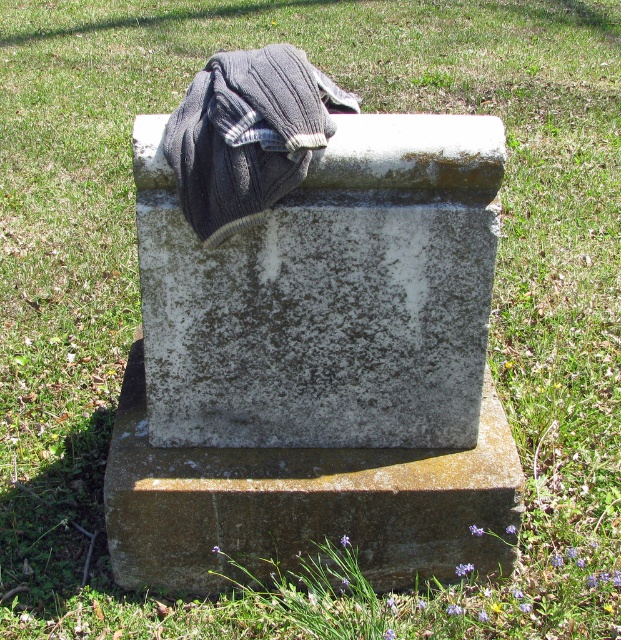
Question: Does gray stone gravestone at center have a greater width compared to gray knitted blanket at upper center?

Choices:
 (A) yes
 (B) no

Answer: (A)

Question: Is gray stone gravestone at center above gray knitted blanket at upper center?

Choices:
 (A) no
 (B) yes

Answer: (A)

Question: Which of the following is the closest to the observer?

Choices:
 (A) gray knitted blanket at upper center
 (B) gray stone gravestone at center

Answer: (A)

Question: Which of the following is the closest to the observer?

Choices:
 (A) (340, 100)
 (B) (122, 468)

Answer: (A)

Question: Among these objects, which one is farthest from the camera?

Choices:
 (A) gray knitted blanket at upper center
 (B) gray stone gravestone at center

Answer: (B)

Question: Is gray stone gravestone at center smaller than gray knitted blanket at upper center?

Choices:
 (A) yes
 (B) no

Answer: (B)